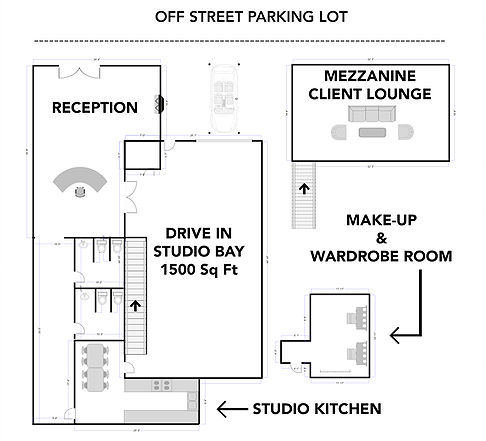
Where is `table`? table is located at coordinates (94, 356), (94, 375).